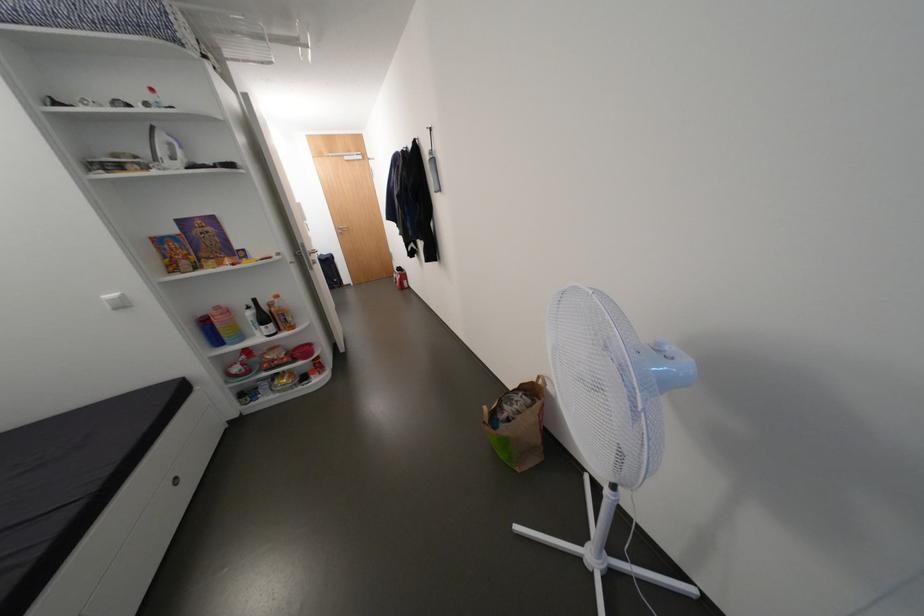
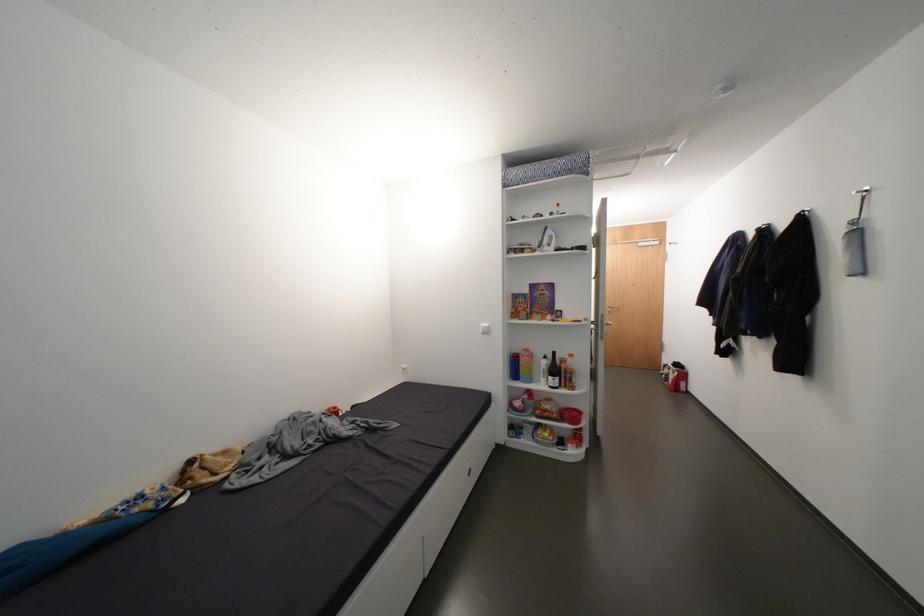
The point at (298, 360) is marked in the first image. Where is the corresponding point in the second image?

(566, 418)